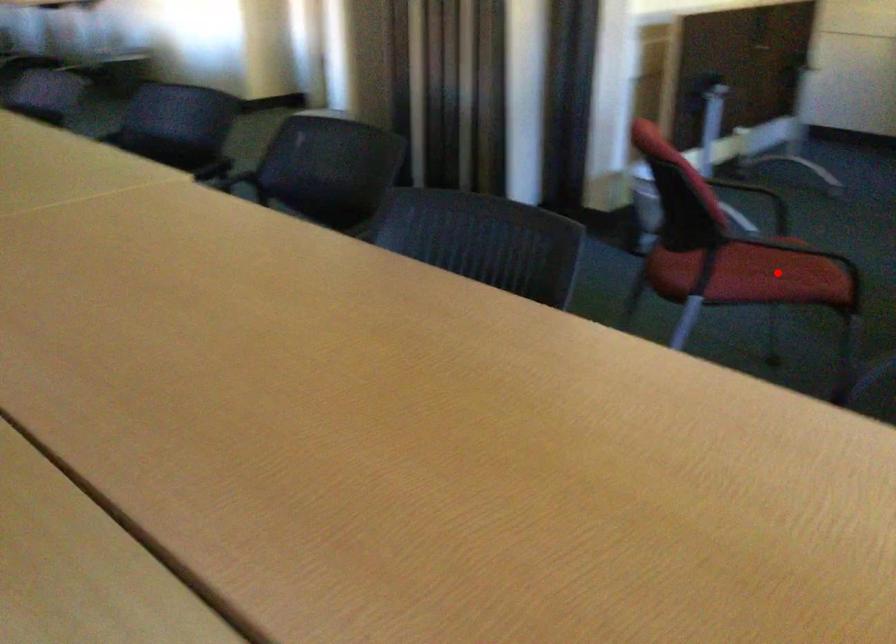
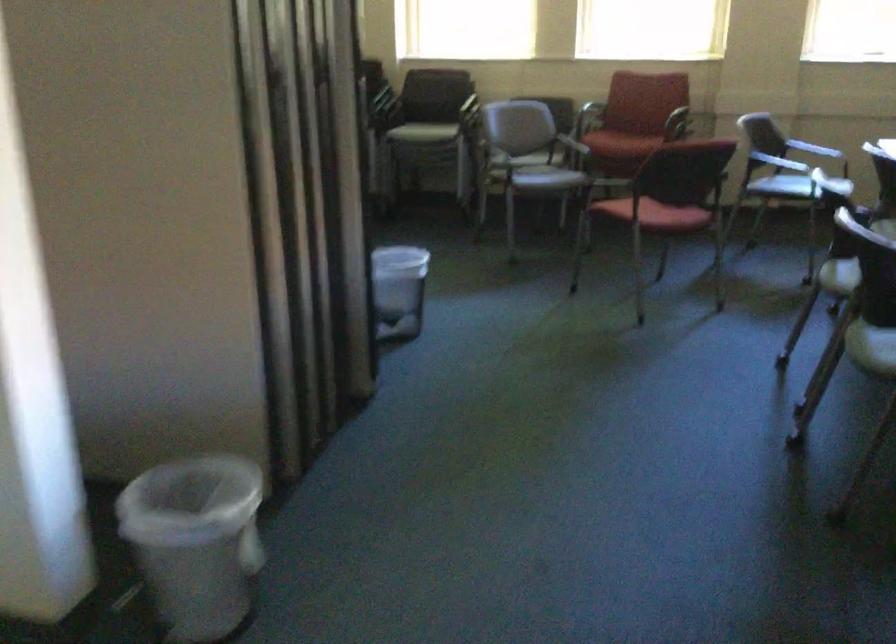
Question: I am providing you with two images of the same scene from different viewpoints. A red point is marked on the first image. At the location where the point appears in image 1, is it still visible in image 2?

Choices:
 (A) Yes
 (B) No

Answer: (B)